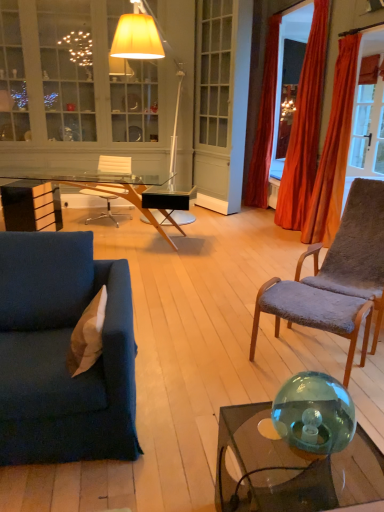
Question: Is velvet blue couch at lower left closer to camera compared to matte white floor lamp at upper center?

Choices:
 (A) yes
 (B) no

Answer: (A)

Question: Is velvet blue couch at lower left taller than matte white floor lamp at upper center?

Choices:
 (A) no
 (B) yes

Answer: (A)

Question: Would you consider velvet blue couch at lower left to be distant from matte white floor lamp at upper center?

Choices:
 (A) no
 (B) yes

Answer: (B)

Question: Does velvet blue couch at lower left have a lesser height compared to matte white floor lamp at upper center?

Choices:
 (A) no
 (B) yes

Answer: (B)

Question: Is velvet blue couch at lower left to the right of matte white floor lamp at upper center from the viewer's perspective?

Choices:
 (A) no
 (B) yes

Answer: (A)

Question: Is velvet blue couch at lower left bigger than matte white floor lamp at upper center?

Choices:
 (A) no
 (B) yes

Answer: (A)

Question: Considering the relative sizes of transparent glass desk at center and transparent glass coffee table at lower right in the image provided, is transparent glass desk at center shorter than transparent glass coffee table at lower right?

Choices:
 (A) no
 (B) yes

Answer: (A)

Question: Can you confirm if transparent glass desk at center is bigger than transparent glass coffee table at lower right?

Choices:
 (A) no
 (B) yes

Answer: (B)

Question: Is transparent glass desk at center located outside transparent glass coffee table at lower right?

Choices:
 (A) yes
 (B) no

Answer: (A)

Question: From the image's perspective, does transparent glass desk at center appear higher than transparent glass coffee table at lower right?

Choices:
 (A) yes
 (B) no

Answer: (A)

Question: Is transparent glass desk at center further to camera compared to transparent glass coffee table at lower right?

Choices:
 (A) yes
 (B) no

Answer: (A)

Question: From a real-world perspective, is transparent glass desk at center positioned over transparent glass coffee table at lower right based on gravity?

Choices:
 (A) no
 (B) yes

Answer: (B)

Question: Could you tell me if gray plush chair at right, which appears as the 1th chair when viewed from the right, is facing transparent glass sphere at lower right?

Choices:
 (A) no
 (B) yes

Answer: (B)